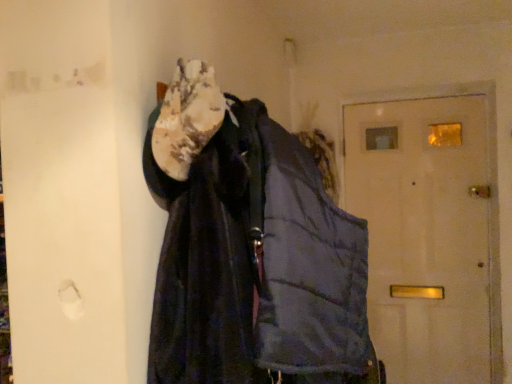
The height and width of the screenshot is (384, 512). Describe the element at coordinates (257, 265) in the screenshot. I see `dark blue quilted jacket at center` at that location.

This screenshot has width=512, height=384. I want to click on white matte door at center, so click(425, 233).

You are a GUI agent. You are given a task and a screenshot of the screen. Output one action in this format:
    pyautogui.click(x=<x>, y=<y>)
    Task: Click on the dark blue quilted jacket at center
    This screenshot has height=384, width=512.
    Given the screenshot: What is the action you would take?
    click(x=257, y=265)

From the image's perspective, which is above, white fuzzy scarf at upper center or dark blue quilted jacket at center?

white fuzzy scarf at upper center.

Is white fuzzy scarf at upper center turned away from dark blue quilted jacket at center?

Absolutely, white fuzzy scarf at upper center is directed away from dark blue quilted jacket at center.

Would you say white fuzzy scarf at upper center is outside dark blue quilted jacket at center?

Actually, white fuzzy scarf at upper center is at least partially inside dark blue quilted jacket at center.

Looking at the image, does white fuzzy scarf at upper center seem bigger or smaller compared to dark blue quilted jacket at center?

In the image, white fuzzy scarf at upper center appears to be smaller than dark blue quilted jacket at center.

Considering the positions of points (169, 275) and (405, 239), is point (169, 275) closer to camera compared to point (405, 239)?

That is True.

What's the angular difference between dark blue quilted jacket at center and white matte door at center's facing directions?

They differ by 89.9 degrees in their facing directions.

Is the depth of dark blue quilted jacket at center greater than that of white matte door at center?

No, dark blue quilted jacket at center is closer to the viewer.

Is dark blue quilted jacket at center surrounding white matte door at center?

No, white matte door at center is not inside dark blue quilted jacket at center.

Which of these two, white matte door at center or dark blue quilted jacket at center, is bigger?

dark blue quilted jacket at center is bigger.

Considering the positions of objects white matte door at center and dark blue quilted jacket at center in the image provided, who is behind, white matte door at center or dark blue quilted jacket at center?

white matte door at center is behind.

From their relative heights in the image, would you say white matte door at center is taller or shorter than dark blue quilted jacket at center?

white matte door at center is taller than dark blue quilted jacket at center.

From a real-world perspective, is white matte door at center positioned above or below dark blue quilted jacket at center?

white matte door at center is below dark blue quilted jacket at center.

Could you tell me if white fuzzy scarf at upper center is facing white matte door at center?

No.

Is white fuzzy scarf at upper center at the right side of white matte door at center?

In fact, white fuzzy scarf at upper center is to the left of white matte door at center.

In terms of height, does white fuzzy scarf at upper center look taller or shorter compared to white matte door at center?

white fuzzy scarf at upper center is shorter than white matte door at center.

Considering the relative positions of white matte door at center and white fuzzy scarf at upper center in the image provided, is white matte door at center to the right of white fuzzy scarf at upper center from the viewer's perspective?

Indeed, white matte door at center is positioned on the right side of white fuzzy scarf at upper center.

Considering the sizes of objects white matte door at center and white fuzzy scarf at upper center in the image provided, who is bigger, white matte door at center or white fuzzy scarf at upper center?

→ white matte door at center is bigger.

From the image's perspective, between white matte door at center and white fuzzy scarf at upper center, who is located below?

white matte door at center, from the image's perspective.

From a real-world perspective, is white matte door at center physically located above or below white fuzzy scarf at upper center?

From a real-world perspective, white matte door at center is physically below white fuzzy scarf at upper center.

From the image's perspective, is dark blue quilted jacket at center above or below white fuzzy scarf at upper center?

From the image's perspective, dark blue quilted jacket at center appears below white fuzzy scarf at upper center.

Would you say dark blue quilted jacket at center is inside or outside white fuzzy scarf at upper center?

dark blue quilted jacket at center is located beyond the bounds of white fuzzy scarf at upper center.

Find the location of `jacket that is under the white fuzzy scarf at upper center (from a real-world perspective)`. jacket that is under the white fuzzy scarf at upper center (from a real-world perspective) is located at coordinates (257, 265).

From a real-world perspective, between dark blue quilted jacket at center and white fuzzy scarf at upper center, who is vertically higher?

In real-world perspective, white fuzzy scarf at upper center is above.

You are a GUI agent. You are given a task and a screenshot of the screen. Output one action in this format:
    pyautogui.click(x=<x>, y=<y>)
    Task: Click on the scarf lying on the left of dark blue quilted jacket at center
    
    Given the screenshot: What is the action you would take?
    pyautogui.click(x=187, y=117)

The image size is (512, 384). I want to click on jacket that is above the white matte door at center (from a real-world perspective), so click(257, 265).

Consider the image. From the image, which object appears to be nearer to dark blue quilted jacket at center, white matte door at center or white fuzzy scarf at upper center?

white fuzzy scarf at upper center is closer to dark blue quilted jacket at center.

Looking at the image, which one is located further to white matte door at center, white fuzzy scarf at upper center or dark blue quilted jacket at center?

white fuzzy scarf at upper center.

Which object lies further to the anchor point white fuzzy scarf at upper center, dark blue quilted jacket at center or white matte door at center?

white matte door at center.

Considering their positions, is white fuzzy scarf at upper center positioned further to dark blue quilted jacket at center than white matte door at center?

Among the two, white matte door at center is located further to dark blue quilted jacket at center.

Based on their spatial positions, is dark blue quilted jacket at center or white fuzzy scarf at upper center closer to white matte door at center?

The object closer to white matte door at center is dark blue quilted jacket at center.

Based on their spatial positions, is white matte door at center or dark blue quilted jacket at center further from white fuzzy scarf at upper center?

white matte door at center is further to white fuzzy scarf at upper center.

Identify the location of scarf between dark blue quilted jacket at center and white matte door at center along the z-axis. This screenshot has width=512, height=384. (187, 117).